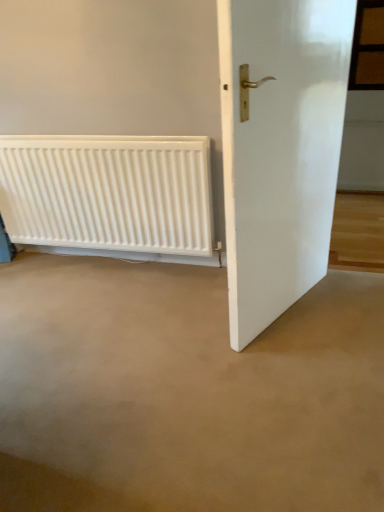
Question: From a real-world perspective, relative to brown wooden window at upper right, is white matte radiator at lower left vertically above or below?

Choices:
 (A) below
 (B) above

Answer: (A)

Question: Looking at their shapes, would you say white matte radiator at lower left is wider or thinner than brown wooden window at upper right?

Choices:
 (A) wide
 (B) thin

Answer: (A)

Question: Estimate the real-world distances between objects in this image. Which object is closer to the white glossy door at right?

Choices:
 (A) white matte radiator at lower left
 (B) brown wooden window at upper right

Answer: (A)

Question: Estimate the real-world distances between objects in this image. Which object is closer to the white matte radiator at lower left?

Choices:
 (A) brown wooden window at upper right
 (B) white glossy door at right

Answer: (B)